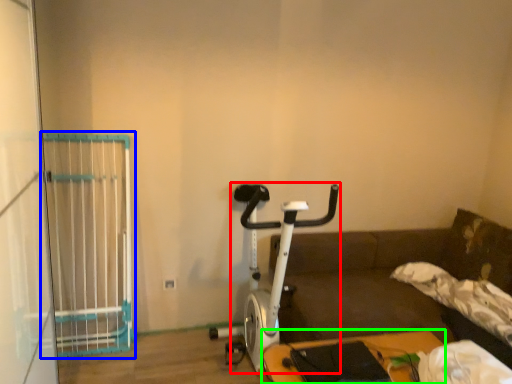
Question: Which is nearer to the stationary bicycle (highlighted by a red box)? cage (highlighted by a blue box) or furniture (highlighted by a green box).

Choices:
 (A) cage
 (B) furniture

Answer: (B)